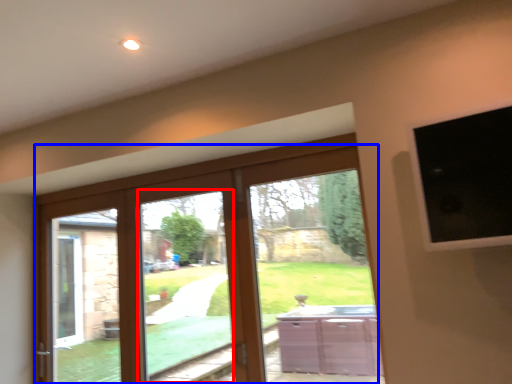
Question: Which object is further to the camera taking this photo, window (highlighted by a red box) or door (highlighted by a blue box)?

Choices:
 (A) window
 (B) door

Answer: (A)